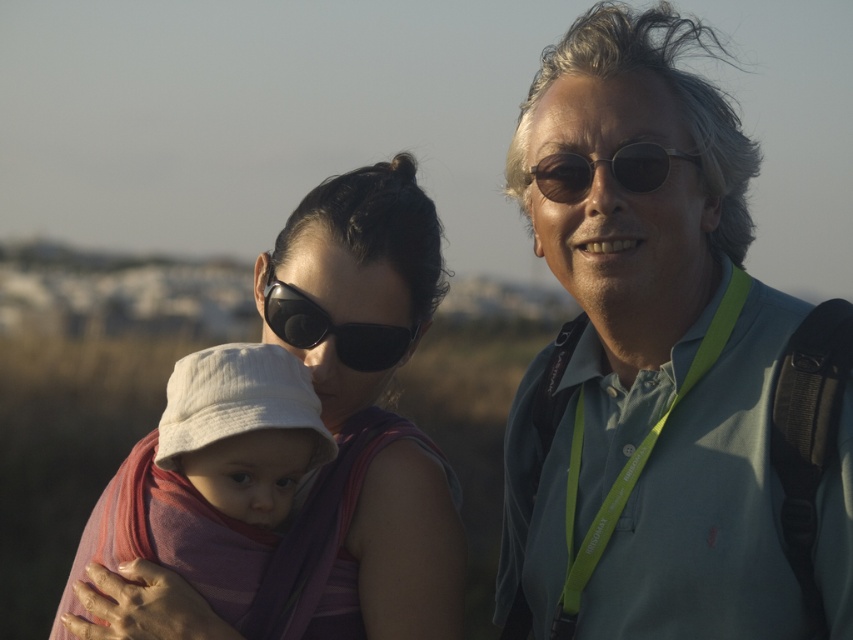
Can you confirm if white cotton hat at center is smaller than sunglasses at center?

Incorrect, white cotton hat at center is not smaller in size than sunglasses at center.

Who is shorter, white cotton hat at center or sunglasses at center?

sunglasses at center is shorter.

At what (x,y) coordinates should I click in order to perform the action: click on white cotton hat at center. Please return your answer as a coordinate pair (x, y). Looking at the image, I should click on (218, 467).

How distant is white cotton hat at center from black matte sunglasses at center?

They are 17.69 inches apart.

Does point (175, 381) come farther from viewer compared to point (341, 333)?

No, (175, 381) is in front of (341, 333).

This screenshot has width=853, height=640. Identify the location of white cotton hat at center. (218, 467).

Is point (732, 595) less distant than point (572, 202)?

That is True.

At what (x,y) coordinates should I click in order to perform the action: click on matte gray hair at upper right. Please return your answer as a coordinate pair (x, y). Looking at the image, I should click on (657, 362).